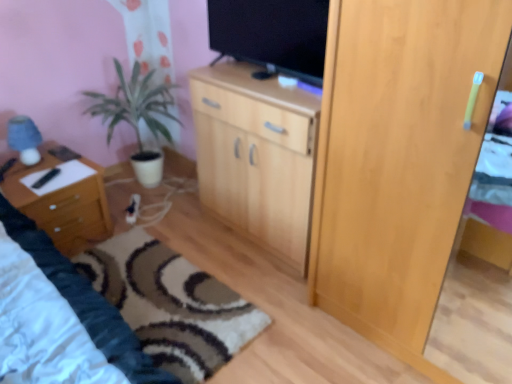
Locate an element on the screen. Image resolution: width=512 pixels, height=384 pixels. free space that is to the left of light wood cupboard at right is located at coordinates (293, 315).